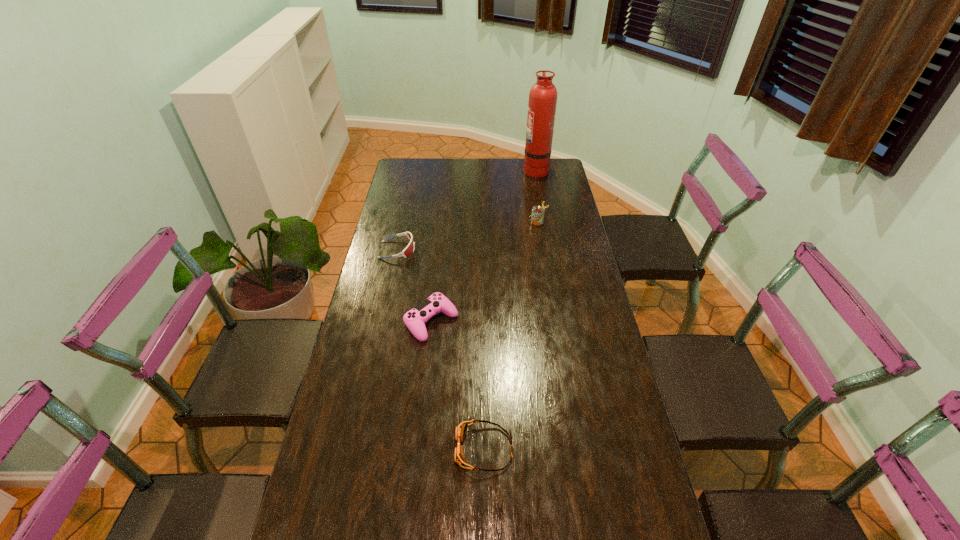
Where is `object at the left edge`? This screenshot has height=540, width=960. object at the left edge is located at coordinates (409, 249).

Where is `fire extinguisher that is at the right edge`? The height and width of the screenshot is (540, 960). fire extinguisher that is at the right edge is located at coordinates (542, 103).

At what (x,y) coordinates should I click in order to perform the action: click on can at the right edge. Please return your answer as a coordinate pair (x, y). Looking at the image, I should click on (537, 215).

Where is `object located at the far right corner`? object located at the far right corner is located at coordinates (542, 103).

Find the location of a particular element. vacant space at the far edge is located at coordinates (435, 163).

In the image, there is a desktop. Identify the location of vacant space at the left edge. The width and height of the screenshot is (960, 540). (307, 525).

At what (x,y) coordinates should I click in order to perform the action: click on vacant region at the right edge. Please return your answer as a coordinate pair (x, y). Looking at the image, I should click on (570, 248).

Find the location of a particular element. vacant space at the far right corner is located at coordinates (554, 158).

You are a GUI agent. You are given a task and a screenshot of the screen. Output one action in this format:
    pyautogui.click(x=<x>, y=<y>)
    Task: Click on the vacant space that is in between the second object from left to right and the shorter goggles
    The height and width of the screenshot is (540, 960).
    Given the screenshot: What is the action you would take?
    pyautogui.click(x=458, y=385)

The width and height of the screenshot is (960, 540). In order to click on empty space that is in between the second tallest object and the third shortest object in this screenshot , I will do `click(485, 272)`.